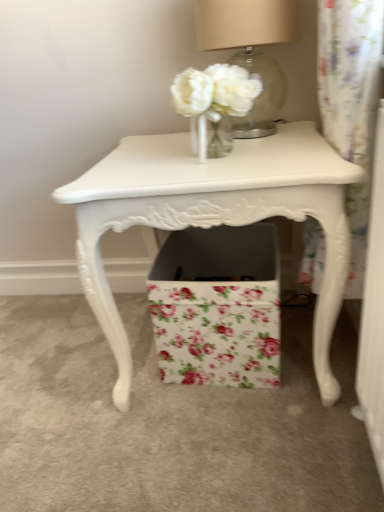
This screenshot has width=384, height=512. In order to click on free location to the left of white painted wood table at center in this screenshot , I will do `click(53, 378)`.